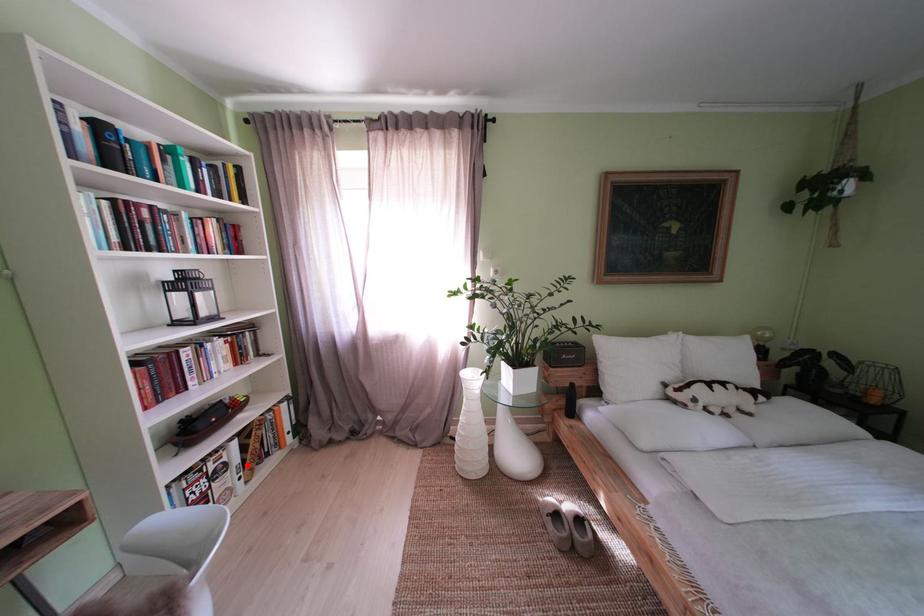
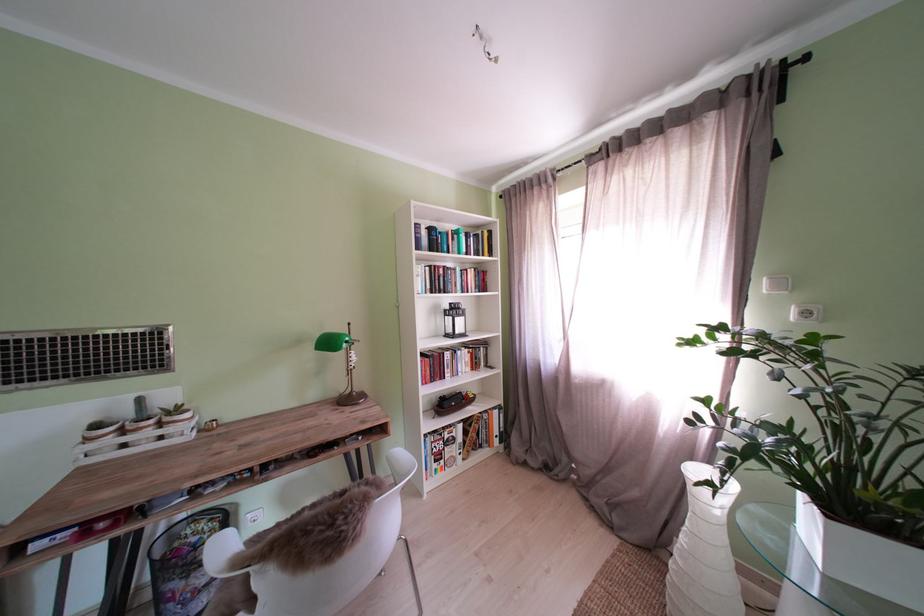
The point at the highlighted location is marked in the first image. Where is the corresponding point in the second image?

(470, 444)